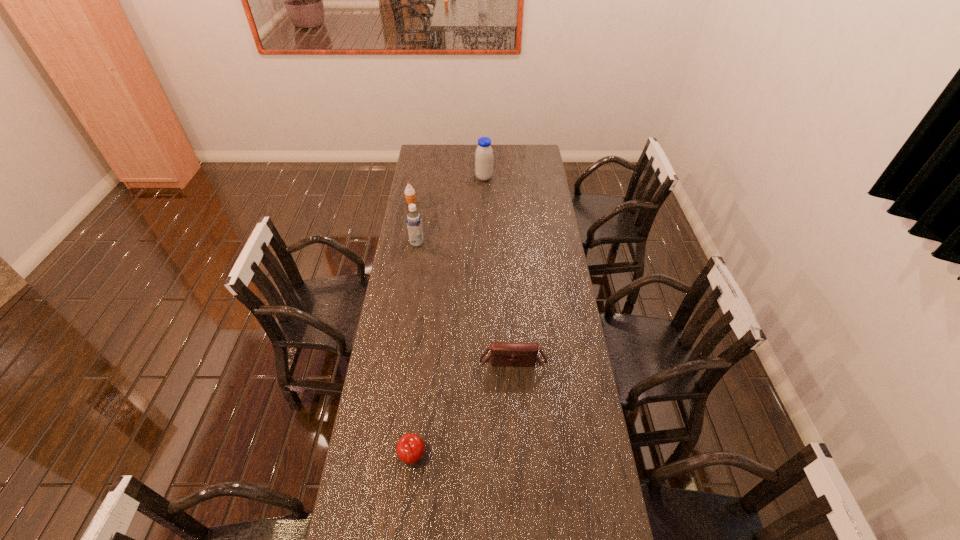
Image resolution: width=960 pixels, height=540 pixels. I want to click on free space between the fourth nearest object and the third object from left to right, so click(412, 330).

Where is `object that is the closest to the farther soya milk`? object that is the closest to the farther soya milk is located at coordinates (409, 192).

Image resolution: width=960 pixels, height=540 pixels. I want to click on object that is the second nearest to the second farthest object, so click(x=484, y=154).

Find the location of `free location that satisfies the following two spatial constraints: 1. on the label of the left soya milk; 2. on the back side of the cherry`. free location that satisfies the following two spatial constraints: 1. on the label of the left soya milk; 2. on the back side of the cherry is located at coordinates (385, 457).